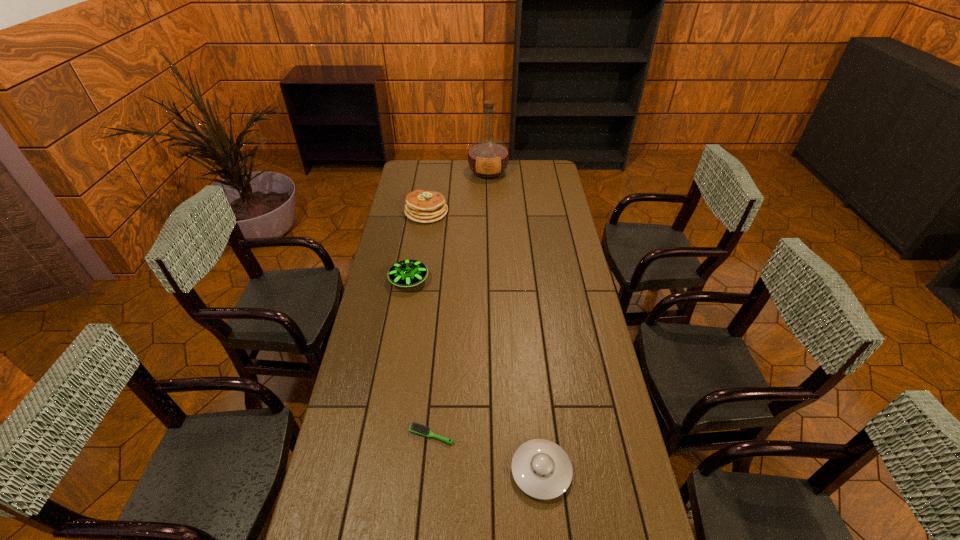
You are a GUI agent. You are given a task and a screenshot of the screen. Output one action in this format:
    pyautogui.click(x=<x>, y=<y>)
    Task: Click on the vacant space at the far right corner of the desktop
    
    Given the screenshot: What is the action you would take?
    pyautogui.click(x=543, y=171)

You are a GUI agent. You are given a task and a screenshot of the screen. Output one action in this format:
    pyautogui.click(x=<x>, y=<y>)
    Task: Click on the vacant space in between the second tallest object and the farthest object
    The width and height of the screenshot is (960, 540).
    Given the screenshot: What is the action you would take?
    pyautogui.click(x=457, y=192)

I want to click on free space between the hairbrush and the fourth tallest object, so click(x=487, y=453).

The height and width of the screenshot is (540, 960). I want to click on unoccupied area between the third shortest object and the second shortest object, so click(x=475, y=376).

Where is `free space that is in between the second tallest object and the hairbrush`? Image resolution: width=960 pixels, height=540 pixels. free space that is in between the second tallest object and the hairbrush is located at coordinates (429, 323).

This screenshot has height=540, width=960. In order to click on free area in between the third farthest object and the tallest object in this screenshot , I will do `click(448, 226)`.

Locate an element on the screen. Image resolution: width=960 pixels, height=540 pixels. free space between the taller saucer and the tallest object is located at coordinates (448, 226).

Locate an element on the screen. blank region between the taller saucer and the shortest object is located at coordinates (420, 358).

Where is `vacant space in between the third tallest object and the farthest object`? The height and width of the screenshot is (540, 960). vacant space in between the third tallest object and the farthest object is located at coordinates (448, 226).

Image resolution: width=960 pixels, height=540 pixels. Find the location of `vacant point located between the shorter saucer and the left saucer`. vacant point located between the shorter saucer and the left saucer is located at coordinates (475, 376).